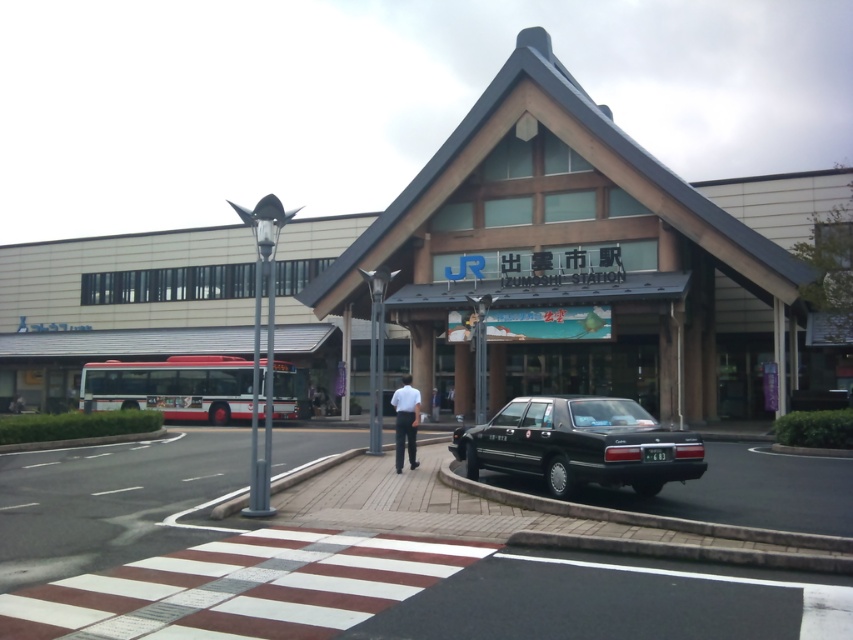
Is the position of brown wooden mall at center more distant than that of black glossy sedan at lower right?

No.

Does point (140, 240) lie behind point (541, 474)?

Yes, point (140, 240) is behind point (541, 474).

Who is more forward, (814, 273) or (648, 424)?

Point (648, 424) is in front.

At what (x,y) coordinates should I click in order to perform the action: click on brown wooden mall at center. Please return your answer as a coordinate pair (x, y). Looking at the image, I should click on (576, 262).

Between brown wooden mall at center and white shirt at center, which one is positioned lower?

white shirt at center is below.

Who is more distant from viewer, (86, 401) or (405, 397)?

The point (86, 401) is behind.

Is point (635, 237) closer to camera compared to point (395, 449)?

No.

Locate an element on the screen. This screenshot has height=640, width=853. brown wooden mall at center is located at coordinates (576, 262).

Can you confirm if brown wooden mall at center is positioned above white fabric shirt at center?

Yes, brown wooden mall at center is above white fabric shirt at center.

Does brown wooden mall at center have a greater width compared to white fabric shirt at center?

Correct, the width of brown wooden mall at center exceeds that of white fabric shirt at center.

Does point (42, 388) come closer to viewer compared to point (432, 417)?

No, (42, 388) is further to viewer.

Locate an element on the screen. The width and height of the screenshot is (853, 640). brown wooden mall at center is located at coordinates (576, 262).